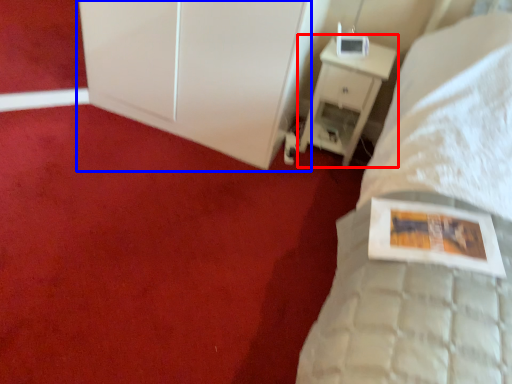
Question: Which object is closer to the camera taking this photo, nightstand (highlighted by a red box) or dresser (highlighted by a blue box)?

Choices:
 (A) nightstand
 (B) dresser

Answer: (B)